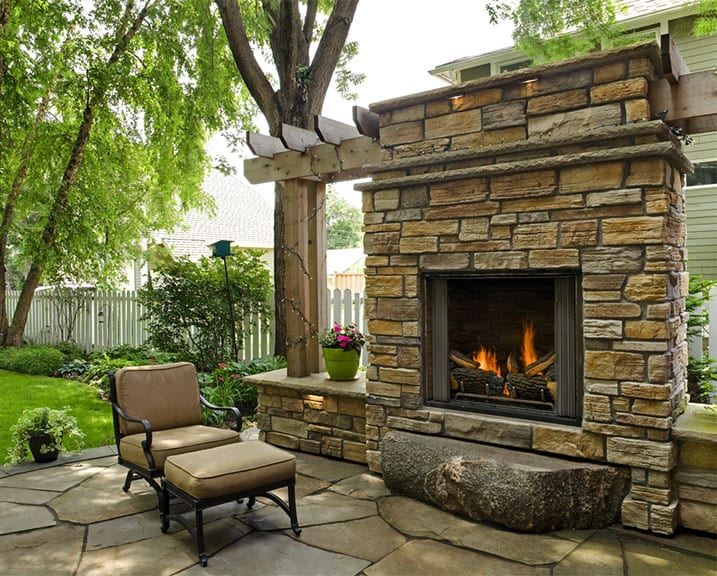
You are a GUI agent. You are given a task and a screenshot of the screen. Output one action in this format:
    pyautogui.click(x=<x>, y=<y>)
    Task: Click on the lights of string
    
    Given the screenshot: What is the action you would take?
    pyautogui.click(x=293, y=241)